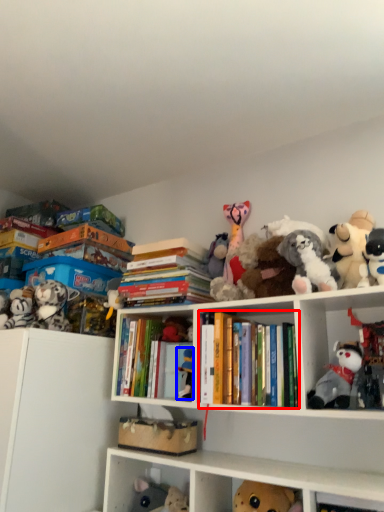
Question: Which object appears farthest to the camera in this image, book (highlighted by a red box) or toy (highlighted by a blue box)?

Choices:
 (A) book
 (B) toy

Answer: (B)